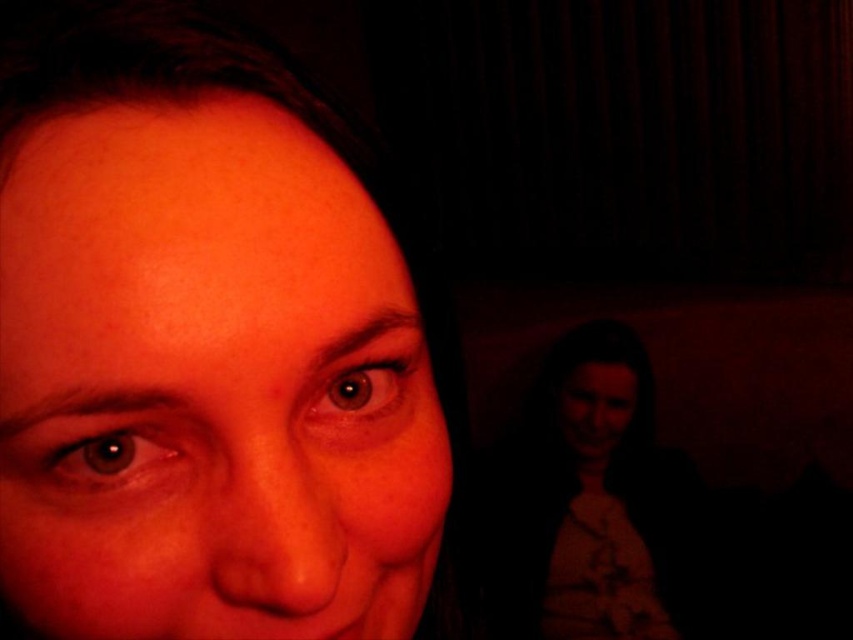
Can you confirm if matte skin at center is wider than matte white blouse at lower right?

In fact, matte skin at center might be narrower than matte white blouse at lower right.

Is matte skin at center taller than matte white blouse at lower right?

In fact, matte skin at center may be shorter than matte white blouse at lower right.

Does point (0, 422) lie behind point (538, 435)?

That is False.

Identify the location of matte skin at center. This screenshot has height=640, width=853. [186, 192].